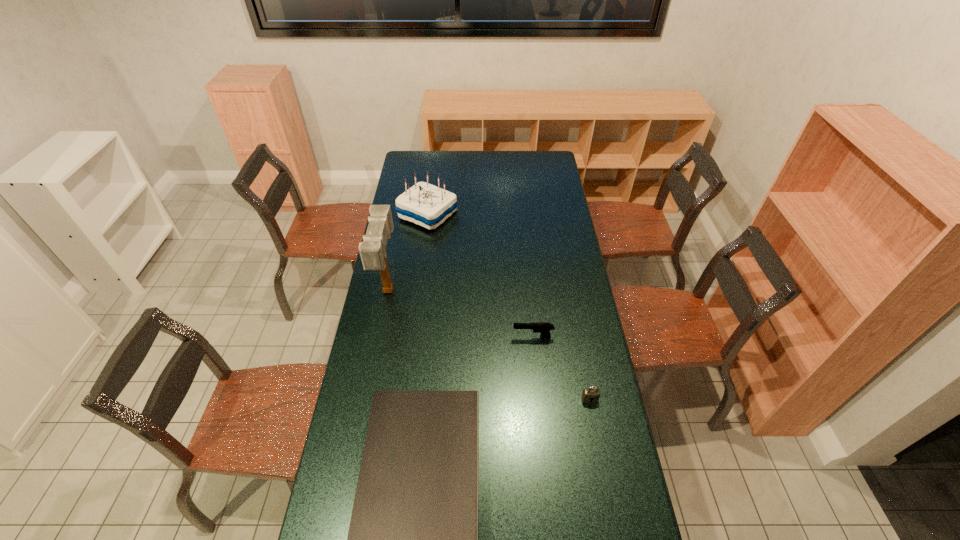
At what (x,y) coordinates should I click in order to perform the action: click on the fourth nearest object. Please return your answer as a coordinate pair (x, y). The width and height of the screenshot is (960, 540). Looking at the image, I should click on (372, 250).

The width and height of the screenshot is (960, 540). I want to click on the tallest object, so click(372, 250).

What are the coordinates of `the second tallest object` in the screenshot? It's located at (424, 204).

Find the location of `birthday cake`. birthday cake is located at coordinates (424, 204).

The width and height of the screenshot is (960, 540). What are the coordinates of `pistol` in the screenshot? It's located at (543, 328).

The width and height of the screenshot is (960, 540). Find the location of `the fourth object from left to right`. the fourth object from left to right is located at coordinates (543, 328).

This screenshot has height=540, width=960. I want to click on the rightmost object, so pos(591,394).

Identify the location of padlock. click(591, 394).

Locate an element on the screen. The width and height of the screenshot is (960, 540). vacant space situated on the right of the mallet is located at coordinates (430, 290).

Where is `vacant position located on the right of the fourth shortest object`? vacant position located on the right of the fourth shortest object is located at coordinates (532, 215).